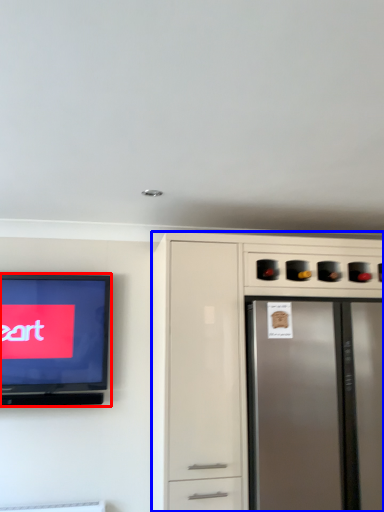
Question: Which object is closer to the camera taking this photo, television (highlighted by a red box) or cabinetry (highlighted by a blue box)?

Choices:
 (A) television
 (B) cabinetry

Answer: (B)